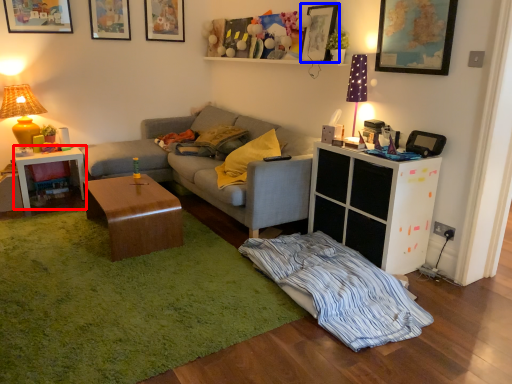
Question: Among these objects, which one is farthest to the camera, table (highlighted by a red box) or picture frame (highlighted by a blue box)?

Choices:
 (A) table
 (B) picture frame

Answer: (A)